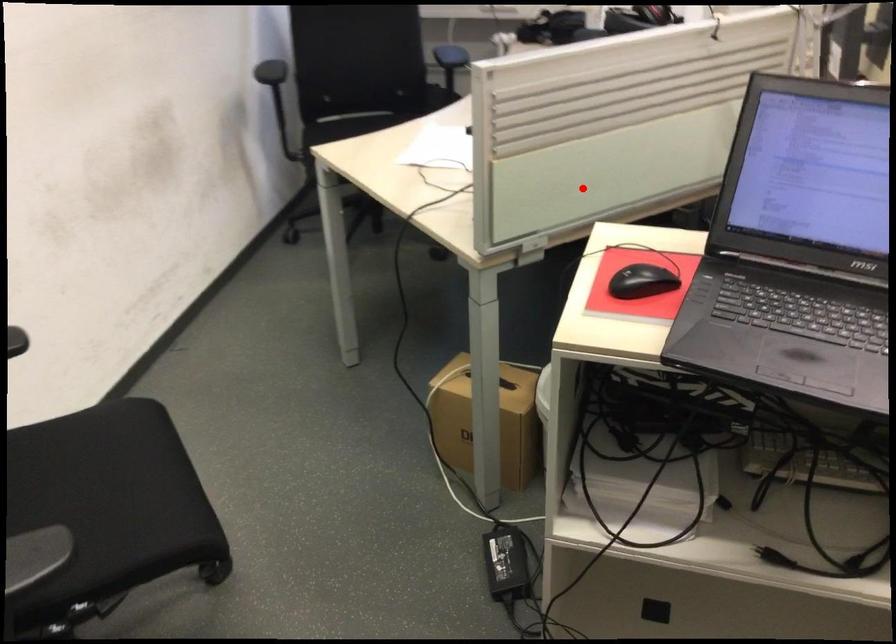
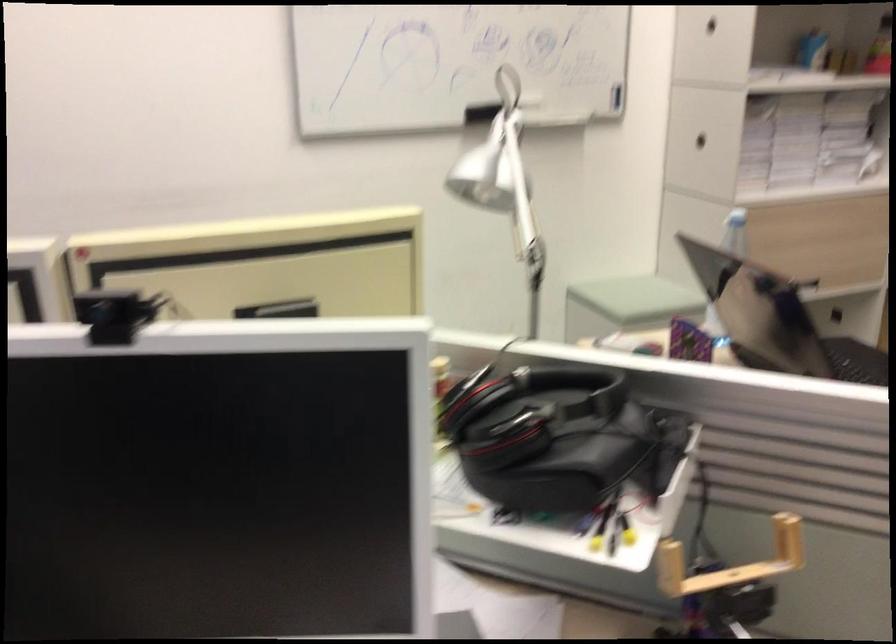
Locate, in the second image, the point that corresponds to the highlighted location in the first image.

(730, 562)